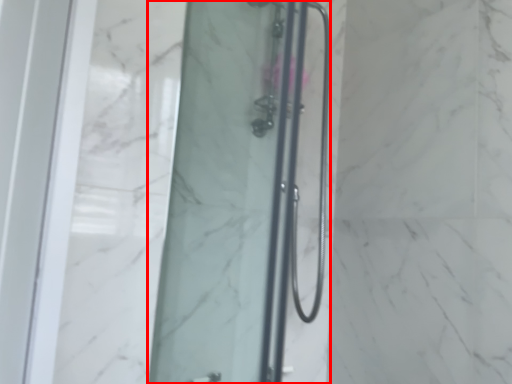
Question: From the image, what is the correct spatial relationship of shower door (annotated by the red box) in relation to shower door?

Choices:
 (A) left
 (B) right

Answer: (A)